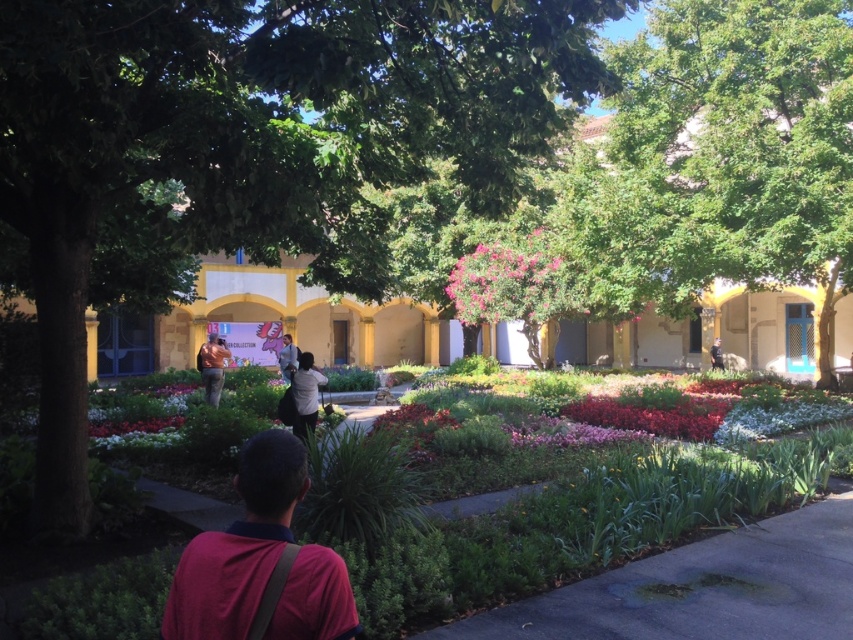
Is point (344, 112) positioned before point (583, 196)?

Yes, it is in front of point (583, 196).

From the picture: Does green leafy tree at center have a larger size compared to green leafy tree at upper right?

No.

This screenshot has height=640, width=853. Identify the location of green leafy tree at center. (248, 148).

How much distance is there between green leafy plants at center and light gray shirt at center?

green leafy plants at center is 20.37 feet from light gray shirt at center.

Between green leafy plants at center and light gray shirt at center, which one is positioned lower?

green leafy plants at center is below.

Find the location of a particular element. The width and height of the screenshot is (853, 640). green leafy plants at center is located at coordinates (583, 525).

This screenshot has height=640, width=853. What are the coordinates of `green leafy plants at center` in the screenshot? It's located at (583, 525).

What do you see at coordinates (701, 588) in the screenshot? I see `green asphalt path at center` at bounding box center [701, 588].

Can you confirm if green asphalt path at center is thinner than brown leather jacket at center?

Correct, green asphalt path at center's width is less than brown leather jacket at center's.

Is point (625, 580) in front of point (210, 372)?

Yes, point (625, 580) is in front of point (210, 372).

In order to click on green asphalt path at center in this screenshot , I will do `click(701, 588)`.